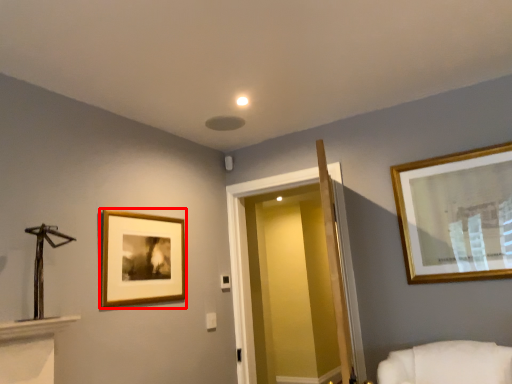
Question: From the image, what is the correct spatial relationship of picture frame (annotated by the red box) in relation to glass door?

Choices:
 (A) left
 (B) right

Answer: (A)